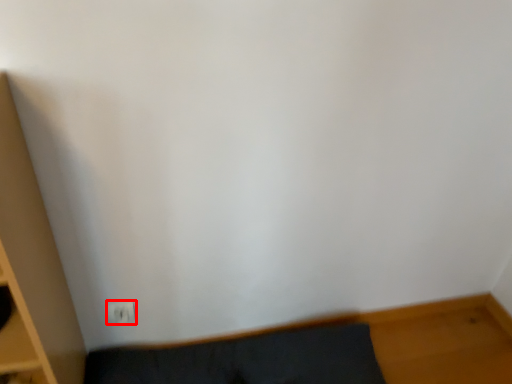
Question: Considering the relative positions of electric outlet (annotated by the red box) and furniture in the image provided, where is electric outlet (annotated by the red box) located with respect to the staircase?

Choices:
 (A) right
 (B) left

Answer: (B)